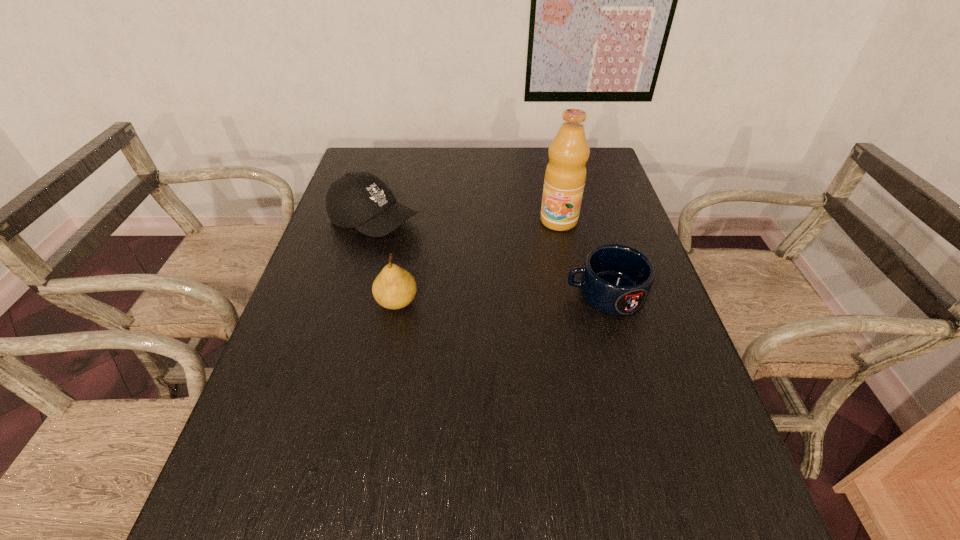
Locate an element on the screen. Image resolution: width=960 pixels, height=540 pixels. vacant space on the desktop that is between the pear and the mug and is positioned on the front-facing side of the baseball cap is located at coordinates (533, 296).

The image size is (960, 540). In order to click on free space on the desktop that is between the pear and the shortest object and is positioned on the front label of the fruit juice in this screenshot , I will do `click(515, 297)`.